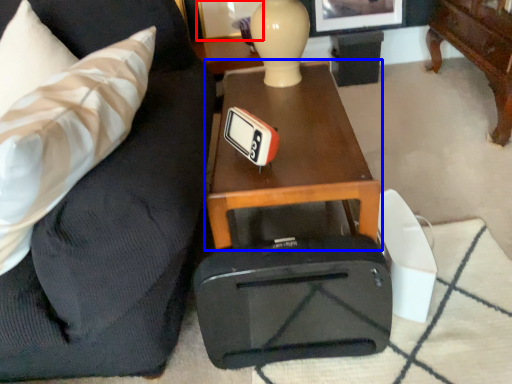
Question: Which of the following is the closest to the observer, picture frame (highlighted by a red box) or table (highlighted by a blue box)?

Choices:
 (A) picture frame
 (B) table

Answer: (B)